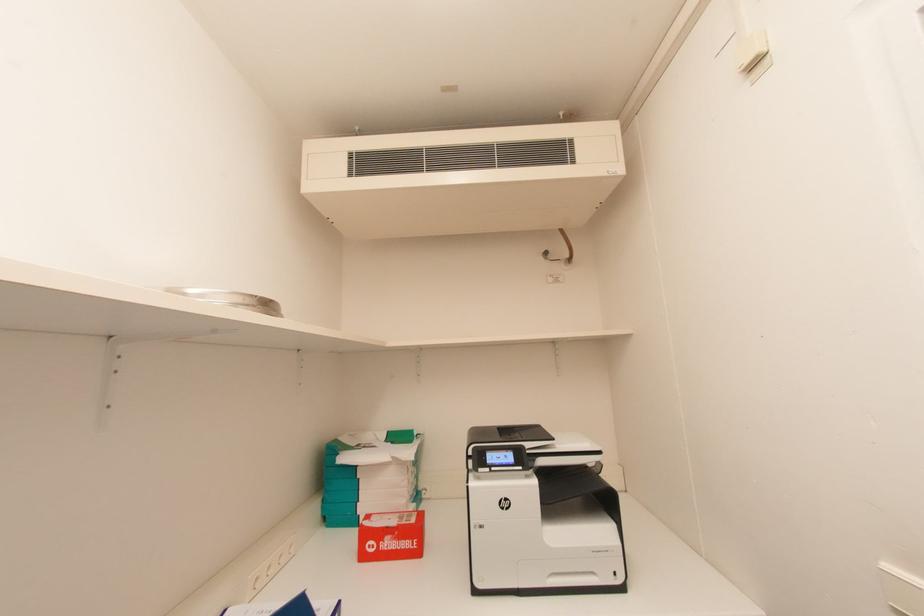
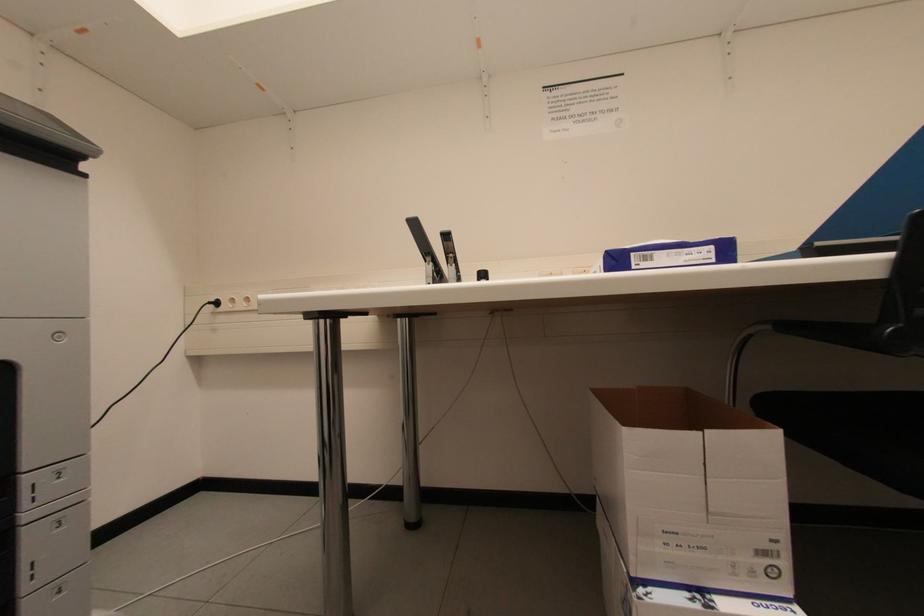
Question: The first image is from the beginning of the video and the second image is from the end. How did the camera likely rotate when shooting the video?

Choices:
 (A) Left
 (B) Right
 (C) Up
 (D) Down

Answer: (A)